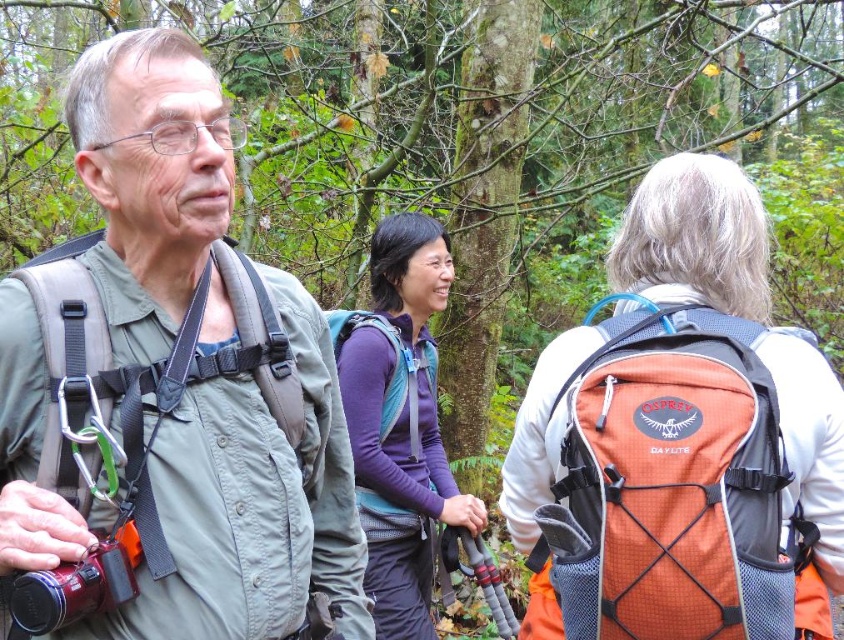
You are planning to take a photo of the matte green jacket at center and the orange mesh backpack at upper right. Which object should you focus on first if you want to capture both in the frame without moving the camera?

You should focus on the matte green jacket at center first because it is narrower than the orange mesh backpack at upper right, allowing it to fit within the frame more easily while keeping the backpack in view.

You are a hiker planning to take a photo of the matte green jacket at center and the orange mesh backpack at upper right. Which object should you focus on first if you want to capture both in a single frame without moving the camera?

The matte green jacket at center is above the orange mesh backpack at upper right, so you should focus on the matte green jacket at center first to ensure both are in the frame.

You are standing at the point with coordinates point (220, 582) and want to move towards the point (350, 317). Based on the image, will you be moving towards or away from the dense forest area?

Point (220, 582) is closer to the viewer than point (350, 317), so moving from point (220, 582) towards point (350, 317) would mean moving away from the dense forest area.